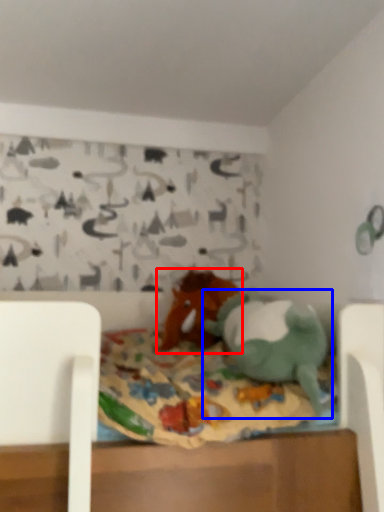
Question: Which object is closer to the camera taking this photo, toy (highlighted by a red box) or toy (highlighted by a blue box)?

Choices:
 (A) toy
 (B) toy

Answer: (B)